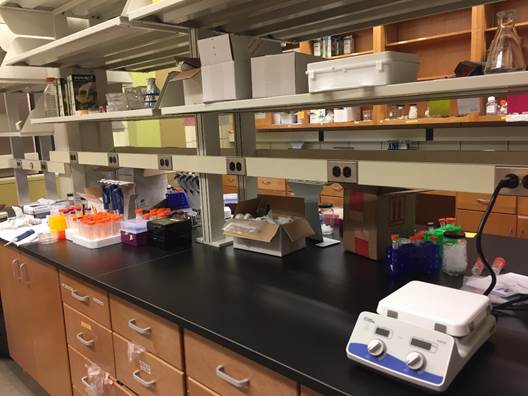
The image size is (528, 396). I want to click on electrical receptacles, so click(x=41, y=166), click(x=17, y=164), click(x=73, y=155), click(x=111, y=160), click(x=162, y=164), click(x=233, y=166), click(x=342, y=167), click(x=513, y=175).